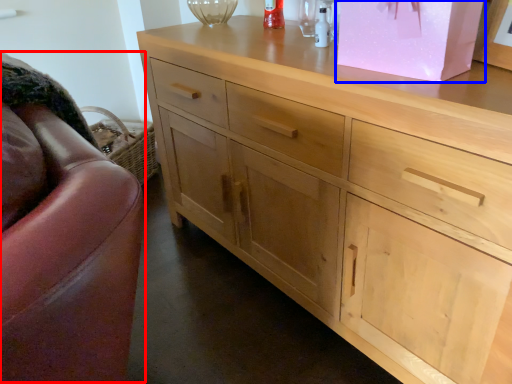
Question: Which object appears closest to the camera in this image, swivel chair (highlighted by a red box) or cabinetry (highlighted by a blue box)?

Choices:
 (A) swivel chair
 (B) cabinetry

Answer: (A)